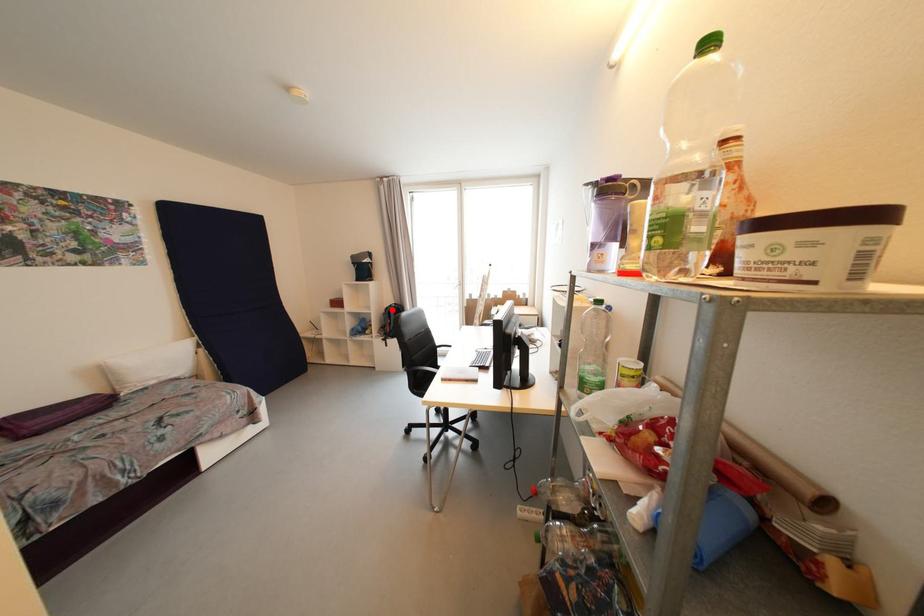
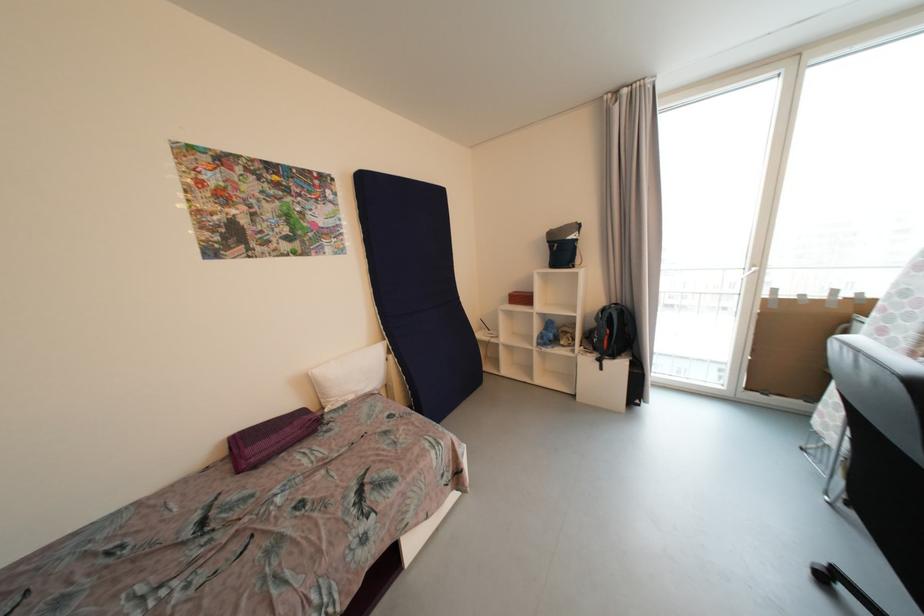
Question: I am providing you with two images of the same scene from different viewpoints. Given a red point in image1, look at the same physical point in image2. Is it:

Choices:
 (A) Closer to the viewpoint
 (B) Farther from the viewpoint

Answer: (A)